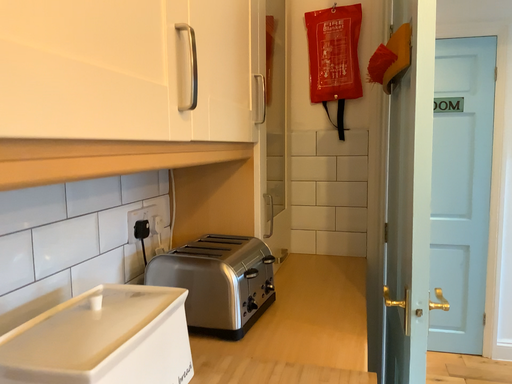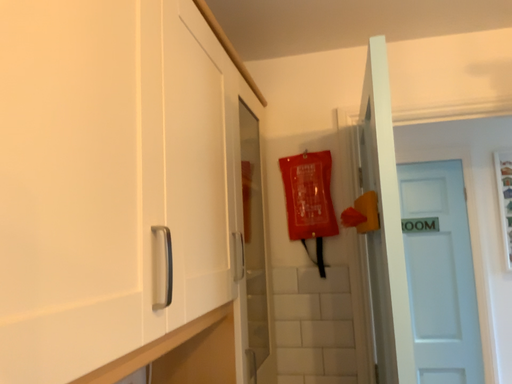
Question: How did the camera likely rotate when shooting the video?

Choices:
 (A) rotated upward
 (B) rotated downward

Answer: (A)